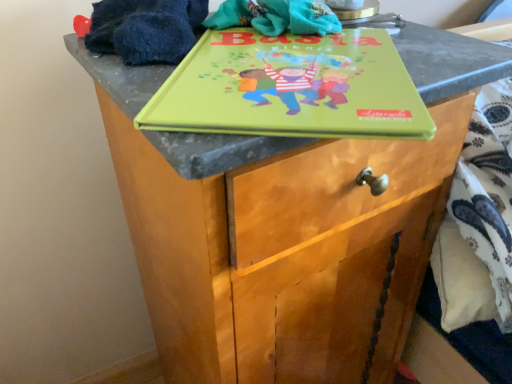
Identify the location of green matte book at center. Image resolution: width=512 pixels, height=384 pixels. (291, 88).

What is the approximate width of green matte book at center?

green matte book at center is 10.50 inches in width.

What do you see at coordinates (291, 88) in the screenshot?
I see `green matte book at center` at bounding box center [291, 88].

Measure the distance between point (318,136) and camera.

The distance of point (318,136) from camera is 10.87 inches.

Image resolution: width=512 pixels, height=384 pixels. I want to click on green matte book at center, so click(291, 88).